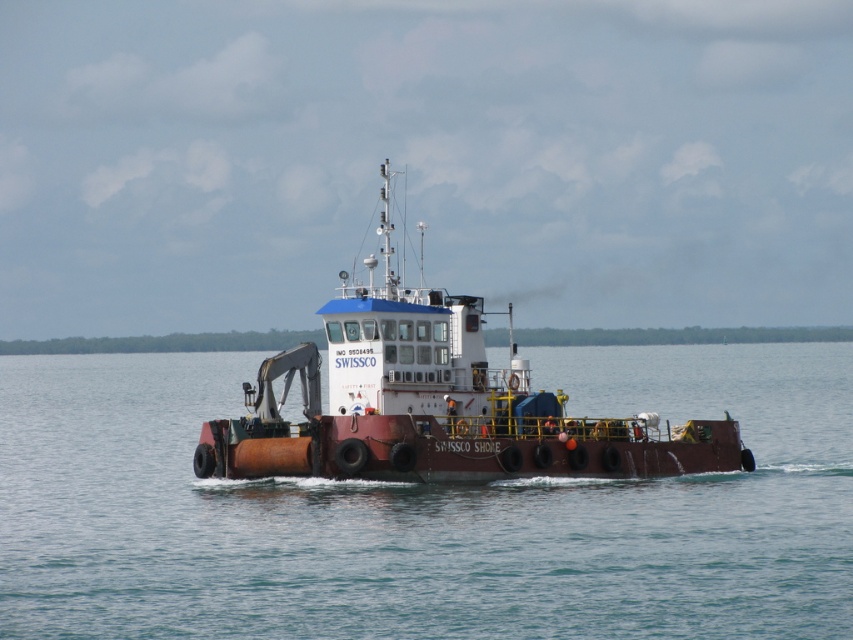
Question: In this image, where is rusty metal water at center located relative to rusty metal barge at center?

Choices:
 (A) right
 (B) left

Answer: (B)

Question: Does rusty metal water at center lie behind rusty metal barge at center?

Choices:
 (A) no
 (B) yes

Answer: (A)

Question: Which object is closer to the camera taking this photo?

Choices:
 (A) rusty metal barge at center
 (B) rusty metal water at center

Answer: (B)

Question: Is rusty metal water at center positioned at the back of rusty metal barge at center?

Choices:
 (A) yes
 (B) no

Answer: (B)